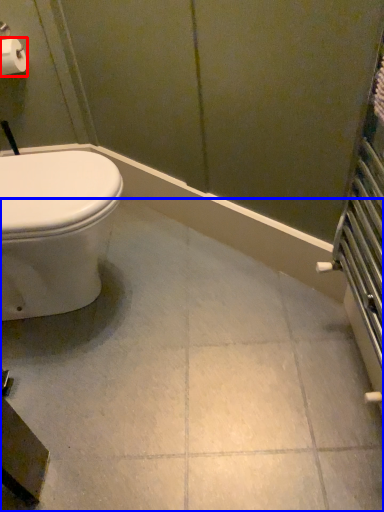
Question: Which object appears closest to the camera in this image, toilet paper (highlighted by a red box) or ceramic tile (highlighted by a blue box)?

Choices:
 (A) toilet paper
 (B) ceramic tile

Answer: (B)